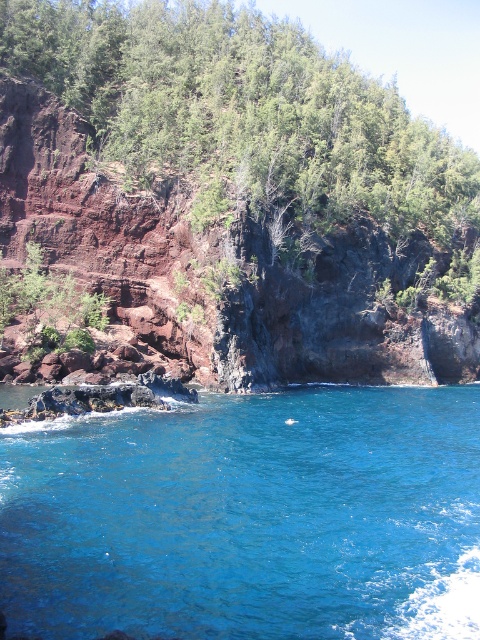
Is blue liquid water at center shorter than green leafy tree at upper center?

Yes.

Does blue liquid water at center appear under green leafy tree at upper center?

Indeed, blue liquid water at center is positioned under green leafy tree at upper center.

Who is more distant from viewer, (307,454) or (212,10)?

Positioned behind is point (212,10).

You are a GUI agent. You are given a task and a screenshot of the screen. Output one action in this format:
    pyautogui.click(x=<x>, y=<y>)
    Task: Click on the blue liquid water at center
    
    Given the screenshot: What is the action you would take?
    pyautogui.click(x=248, y=516)